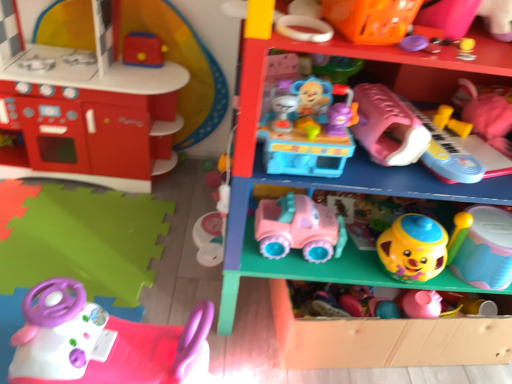
What are the coordinates of `yellow rubber toy at upper right, the ninth toy positioned from the left` in the screenshot? It's located at (451, 121).

How much space does matte pink car at lower center, placed as the 1th shelf when sorted from bottom to top, occupy vertically?

The height of matte pink car at lower center, placed as the 1th shelf when sorted from bottom to top, is 27.33 centimeters.

You are a GUI agent. You are given a task and a screenshot of the screen. Output one action in this format:
    pyautogui.click(x=<x>, y=<y>)
    Task: Click on the rubberized yellow ball at upper right, the seventh toy viewed from the left
    This screenshot has height=384, width=512.
    Given the screenshot: What is the action you would take?
    pyautogui.click(x=448, y=16)

Image resolution: width=512 pixels, height=384 pixels. I want to click on smooth yellow plastic cup at lower right, acting as the 10th toy starting from the left, so click(x=486, y=249).

Find the location of a particular element. Image resolution: width=512 pixels, height=384 pixels. yellow rubber toy at upper right, the third toy positioned from the right is located at coordinates (451, 121).

From a real-world perspective, is rubberized pink toy piano at right, the eleventh toy in the left-to-right sequence, positioned above or below orange plastic basket at upper right, which is the 5th toy in left-to-right order?

Clearly, from a real-world perspective, rubberized pink toy piano at right, the eleventh toy in the left-to-right sequence, is below orange plastic basket at upper right, which is the 5th toy in left-to-right order.

Is rubberized pink toy piano at right, the eleventh toy in the left-to-right sequence, far away from orange plastic basket at upper right, which is counted as the 7th toy, starting from the right?

Actually, rubberized pink toy piano at right, the eleventh toy in the left-to-right sequence, and orange plastic basket at upper right, which is counted as the 7th toy, starting from the right, are a little close together.

What's the angular difference between rubberized pink toy piano at right, the 1th toy when ordered from right to left, and orange plastic basket at upper right, which is the 5th toy in left-to-right order,'s facing directions?

rubberized pink toy piano at right, the 1th toy when ordered from right to left, and orange plastic basket at upper right, which is the 5th toy in left-to-right order, are facing 12.6 degrees away from each other.

Measure the distance from yellow plastic cup at center right, the 4th toy in the right-to-left sequence, to pink plastic steering wheel at lower left, marked as the ninth toy in a right-to-left arrangement.

They are 28.33 inches apart.

From a real-world perspective, is yellow plastic cup at center right, the eighth toy viewed from the left, beneath pink plastic steering wheel at lower left, which ranks as the third toy in left-to-right order?

No, from a real-world perspective, yellow plastic cup at center right, the eighth toy viewed from the left, is not below pink plastic steering wheel at lower left, which ranks as the third toy in left-to-right order.

Does point (428, 236) come farther from viewer compared to point (80, 333)?

Yes, point (428, 236) is behind point (80, 333).

Consider the image. Does shiny plastic toy car at upper left, which is the tenth toy in right-to-left order, have a lesser width compared to matte red kitchen set at left, the 11th toy viewed from the right?

Yes.

Is matte red kitchen set at left, the 11th toy viewed from the right, at the back of shiny plastic toy car at upper left, the 2th toy positioned from the left?

Yes, shiny plastic toy car at upper left, the 2th toy positioned from the left, is facing away from matte red kitchen set at left, the 11th toy viewed from the right.

At what (x,y) coordinates should I click in order to perform the action: click on the 1st toy located above the matte red kitchen set at left, acting as the first toy starting from the left (from a real-world perspective). Please return your answer as a coordinate pair (x, y). The width and height of the screenshot is (512, 384). Looking at the image, I should click on (143, 50).

From a real-world perspective, which object rests below the other?

rubberized pink toy piano at right, the 1th toy when ordered from right to left, from a real-world perspective.

How much distance is there between rubberized pink toy piano at right, the eleventh toy in the left-to-right sequence, and purple plastic lid at upper center, which is counted as the sixth toy, starting from the left?

22.37 inches.

Considering the points (473, 88) and (407, 44), which point is behind, point (473, 88) or point (407, 44)?

The point (473, 88) is farther.

Considering the positions of objects rubberized pink toy piano at right, the 1th toy when ordered from right to left, and purple plastic lid at upper center, which is counted as the sixth toy, starting from the left, in the image provided, who is more to the left, rubberized pink toy piano at right, the 1th toy when ordered from right to left, or purple plastic lid at upper center, which is counted as the sixth toy, starting from the left,?

purple plastic lid at upper center, which is counted as the sixth toy, starting from the left.

From the image's perspective, which is above, pink plastic steering wheel at lower left, which ranks as the third toy in left-to-right order, or shiny plastic toy car at upper left, the 2th toy positioned from the left?

shiny plastic toy car at upper left, the 2th toy positioned from the left, from the image's perspective.

From a real-world perspective, is pink plastic steering wheel at lower left, which ranks as the third toy in left-to-right order, physically below shiny plastic toy car at upper left, the 2th toy positioned from the left?

Yes, from a real-world perspective, pink plastic steering wheel at lower left, which ranks as the third toy in left-to-right order, is beneath shiny plastic toy car at upper left, the 2th toy positioned from the left.

Is pink plastic steering wheel at lower left, marked as the ninth toy in a right-to-left arrangement, facing towards shiny plastic toy car at upper left, which is the tenth toy in right-to-left order?

No, pink plastic steering wheel at lower left, marked as the ninth toy in a right-to-left arrangement, is not aimed at shiny plastic toy car at upper left, which is the tenth toy in right-to-left order.

Between pink plastic steering wheel at lower left, which ranks as the third toy in left-to-right order, and shiny plastic toy car at upper left, which is the tenth toy in right-to-left order, which one appears on the right side from the viewer's perspective?

pink plastic steering wheel at lower left, which ranks as the third toy in left-to-right order.

Which is closer, (426, 40) or (14, 380)?

Point (426, 40).

Is purple plastic lid at upper center, which is counted as the sixth toy, starting from the left, in front of or behind pink plastic steering wheel at lower left, which ranks as the third toy in left-to-right order, in the image?

Visually, purple plastic lid at upper center, which is counted as the sixth toy, starting from the left, is located in front of pink plastic steering wheel at lower left, which ranks as the third toy in left-to-right order.

Looking at their sizes, would you say purple plastic lid at upper center, which is counted as the sixth toy, starting from the left, is wider or thinner than pink plastic steering wheel at lower left, marked as the ninth toy in a right-to-left arrangement?

Considering their sizes, purple plastic lid at upper center, which is counted as the sixth toy, starting from the left, looks slimmer than pink plastic steering wheel at lower left, marked as the ninth toy in a right-to-left arrangement.

Does matte red kitchen set at left, the 11th toy viewed from the right, have a smaller size compared to pink rubber car at center, positioned as the fourth toy in left-to-right order?

No, matte red kitchen set at left, the 11th toy viewed from the right, is not smaller than pink rubber car at center, positioned as the fourth toy in left-to-right order.

Is matte red kitchen set at left, acting as the first toy starting from the left, not close to pink rubber car at center, the eighth toy viewed from the right?

matte red kitchen set at left, acting as the first toy starting from the left, is near pink rubber car at center, the eighth toy viewed from the right, not far away.

Between matte red kitchen set at left, the 11th toy viewed from the right, and pink rubber car at center, the eighth toy viewed from the right, which one has less height?

Standing shorter between the two is pink rubber car at center, the eighth toy viewed from the right.

Which is behind, point (72, 163) or point (272, 215)?

The point (72, 163) is more distant.

Identify the location of the 2nd toy located above the rubberized pink toy piano at right, the 1th toy when ordered from right to left (from a real-world perspective). The image size is (512, 384). (371, 19).

This screenshot has width=512, height=384. I want to click on the 2nd toy in front of the yellow plastic cup at center right, the 4th toy in the right-to-left sequence, so click(103, 342).

From the image, which object appears to be farther from rubberized yellow ball at upper right, which appears as the fifth toy when viewed from the right, yellow rubber toy at upper right, the third toy positioned from the right, or matte pink car at lower center, placed as the 1th shelf when sorted from bottom to top?

matte pink car at lower center, placed as the 1th shelf when sorted from bottom to top.

Based on their spatial positions, is purple plastic lid at upper center, which appears as the 6th toy when viewed from the right, or shiny plastic toy car at upper left, which is the tenth toy in right-to-left order, closer to smooth yellow plastic cup at lower right, which ranks as the second toy in right-to-left order?

purple plastic lid at upper center, which appears as the 6th toy when viewed from the right.

Estimate the real-world distances between objects in this image. Which object is closer to yellow plastic cup at center right, the 4th toy in the right-to-left sequence, matte red kitchen set at left, acting as the first toy starting from the left, or pink plastic steering wheel at lower left, which ranks as the third toy in left-to-right order?

pink plastic steering wheel at lower left, which ranks as the third toy in left-to-right order, is closer to yellow plastic cup at center right, the 4th toy in the right-to-left sequence.

Looking at the image, which one is located further to yellow plastic cup at center right, the eighth toy viewed from the left, yellow rubber toy at upper right, the third toy positioned from the right, or pink plastic toy car at center, placed as the 1th shelf when sorted from top to bottom?

Among the two, yellow rubber toy at upper right, the third toy positioned from the right, is located further to yellow plastic cup at center right, the eighth toy viewed from the left.

From the image, which object appears to be farther from purple plastic lid at upper center, which appears as the 6th toy when viewed from the right, pink rubber car at center, positioned as the fourth toy in left-to-right order, or orange plastic basket at upper right, which is counted as the 7th toy, starting from the right?

pink rubber car at center, positioned as the fourth toy in left-to-right order, is further to purple plastic lid at upper center, which appears as the 6th toy when viewed from the right.

When comparing their distances from rubberized yellow ball at upper right, which appears as the fifth toy when viewed from the right, does orange plastic basket at upper right, which is counted as the 7th toy, starting from the right, or pink rubber car at center, the eighth toy viewed from the right, seem closer?

orange plastic basket at upper right, which is counted as the 7th toy, starting from the right, is positioned closer to the anchor rubberized yellow ball at upper right, which appears as the fifth toy when viewed from the right.

Which object lies nearer to the anchor point pink plastic toy car at center, placed as the 1th shelf when sorted from top to bottom, shiny plastic toy car at upper left, which is the tenth toy in right-to-left order, or yellow plastic cup at center right, the eighth toy viewed from the left?

Based on the image, yellow plastic cup at center right, the eighth toy viewed from the left, appears to be nearer to pink plastic toy car at center, placed as the 1th shelf when sorted from top to bottom.

Which object lies further to the anchor point pink plastic steering wheel at lower left, which ranks as the third toy in left-to-right order, shiny plastic toy car at upper left, the 2th toy positioned from the left, or rubberized yellow ball at upper right, which appears as the fifth toy when viewed from the right?

shiny plastic toy car at upper left, the 2th toy positioned from the left.

Image resolution: width=512 pixels, height=384 pixels. I want to click on shelf between rubberized pink toy piano at right, the eleventh toy in the left-to-right sequence, and yellow plastic cup at center right, the 4th toy in the right-to-left sequence, vertically, so click(352, 244).

Find the location of a particular element. The image size is (512, 384). shelf located between shiny plastic toy car at upper left, the 2th toy positioned from the left, and yellow plastic cup at center right, the eighth toy viewed from the left, in the left-right direction is located at coordinates (352, 244).

Locate an element on the screen. shelf between orange plastic basket at upper right, which is counted as the 7th toy, starting from the right, and yellow plastic cup at center right, the eighth toy viewed from the left, in the up-down direction is located at coordinates (352, 244).

Find the location of a particular element. shelf between rubberized yellow ball at upper right, which appears as the fifth toy when viewed from the right, and pink rubber car at center, the eighth toy viewed from the right, in the up-down direction is located at coordinates coord(352,244).